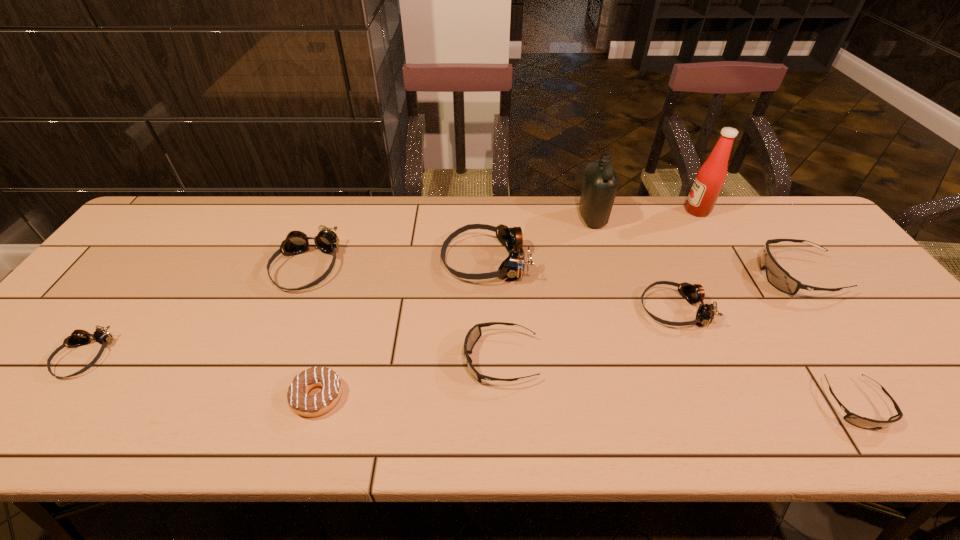
Locate an element on the screen. The width and height of the screenshot is (960, 540). the third goggles from right to left is located at coordinates (694, 293).

This screenshot has width=960, height=540. I want to click on the second biggest black goggles, so click(473, 335).

Image resolution: width=960 pixels, height=540 pixels. Identify the location of the leftmost goggles. (78, 337).

Image resolution: width=960 pixels, height=540 pixels. Find the location of `the leftmost object`. the leftmost object is located at coordinates (78, 337).

You are a GUI agent. You are given a task and a screenshot of the screen. Output one action in this format:
    pyautogui.click(x=<x>, y=<y>)
    Task: Click on the chocolate doughnut
    This screenshot has height=540, width=960.
    Given the screenshot: What is the action you would take?
    click(x=302, y=403)

Where is `the smallest black goggles`? The image size is (960, 540). the smallest black goggles is located at coordinates (862, 422).

I want to click on vacant area situated 0.140m on the front-facing side of the red condiment, so click(x=641, y=211).

Find the location of a particular element. This screenshot has height=540, width=960. free location located on the front-facing side of the red condiment is located at coordinates (583, 211).

The height and width of the screenshot is (540, 960). I want to click on vacant space located 0.230m on the front-facing side of the red condiment, so click(613, 211).

Where is `vacant area located on the right of the second tallest object`? vacant area located on the right of the second tallest object is located at coordinates (686, 218).